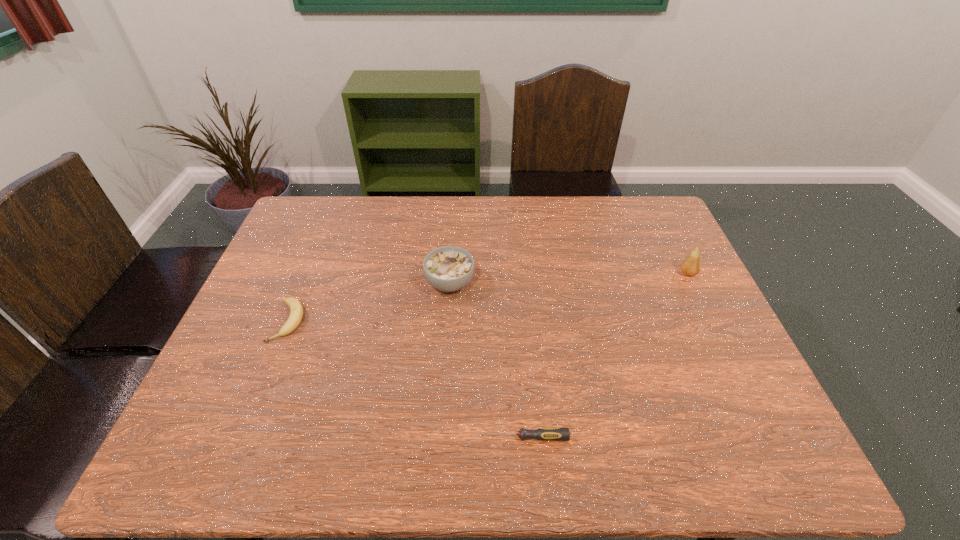
Identify the location of pear. (691, 266).

You are a GUI agent. You are given a task and a screenshot of the screen. Output one action in this format:
    pyautogui.click(x=<x>, y=<y>)
    Task: Click on the soup bowl
    The image size is (960, 540).
    Given the screenshot: What is the action you would take?
    pyautogui.click(x=448, y=269)

I want to click on the leftmost object, so click(x=296, y=308).

The image size is (960, 540). Identify the location of the third tallest object. (296, 308).

Identify the location of the third object from left to right. (544, 434).

Find the location of `the shortest object`. the shortest object is located at coordinates (544, 434).

Where is `vacant space located on the left of the rightmost object`? The width and height of the screenshot is (960, 540). vacant space located on the left of the rightmost object is located at coordinates (561, 273).

Locate an element on the screen. The height and width of the screenshot is (540, 960). free spot located on the back of the second object from left to right is located at coordinates (454, 228).

What are the coordinates of `free location located at the stem of the banana` in the screenshot? It's located at (249, 418).

I want to click on free space located 0.230m insert the second object from right to left into a screw head, so click(x=373, y=437).